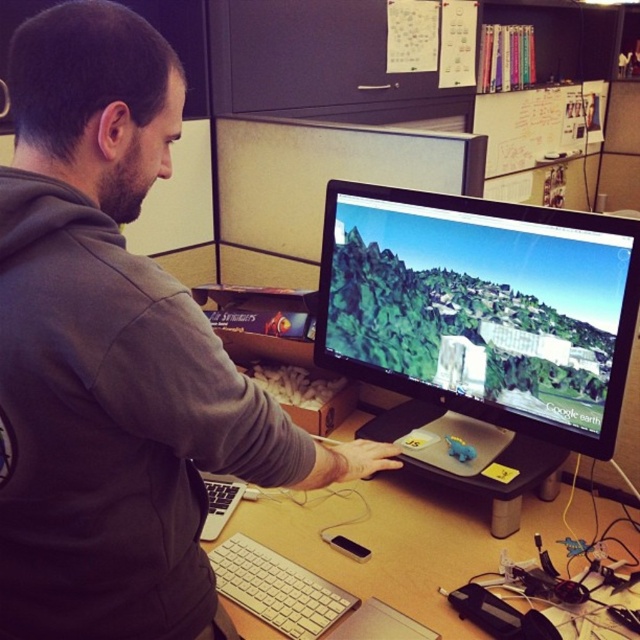
Question: Is matte black monitor at center in front of silver metallic keyboard at lower center?

Choices:
 (A) yes
 (B) no

Answer: (A)

Question: Which object is positioned closest to the silver metallic keyboard at lower center?

Choices:
 (A) gray matte hoodie at center
 (B) matte black monitor at center
 (C) wooden desk at center

Answer: (C)

Question: Which point appears farthest from the camera in this image?

Choices:
 (A) (605, 506)
 (B) (54, 372)
 (C) (307, 600)

Answer: (A)

Question: Can you confirm if matte black monitor at center is positioned below silver metallic keyboard at lower center?

Choices:
 (A) no
 (B) yes

Answer: (A)

Question: Observing the image, what is the correct spatial positioning of wooden desk at center in reference to silver metallic keyboard at lower center?

Choices:
 (A) above
 (B) below

Answer: (A)

Question: Which point is farther from the camera taking this photo?

Choices:
 (A) (192, 336)
 (B) (552, 342)
 (C) (252, 632)

Answer: (B)